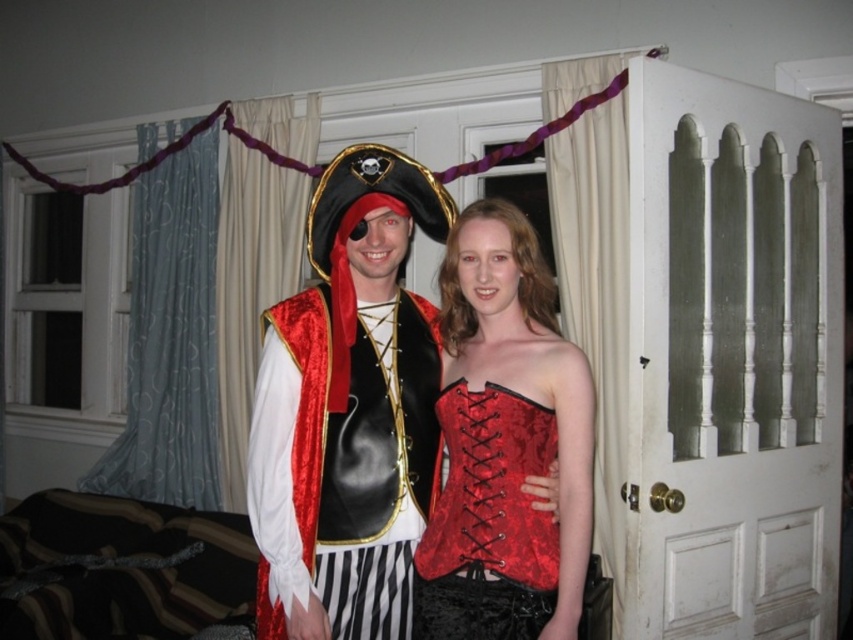
Which is below, velvet red corset at center or velvet/red vest at center?

velvet/red vest at center is below.

Find the location of a particular element. The width and height of the screenshot is (853, 640). velvet red corset at center is located at coordinates (505, 444).

The width and height of the screenshot is (853, 640). What are the coordinates of `velvet red corset at center` in the screenshot? It's located at (505, 444).

Who is taller, velvet pirate costume at center or red velvet corset at center?

Standing taller between the two is velvet pirate costume at center.

Does velvet pirate costume at center come behind red velvet corset at center?

Yes.

At what (x,y) coordinates should I click in order to perform the action: click on velvet pirate costume at center. Please return your answer as a coordinate pair (x, y). Image resolution: width=853 pixels, height=640 pixels. Looking at the image, I should click on (349, 410).

Identify the location of velvet pirate costume at center. This screenshot has width=853, height=640. (349, 410).

Can you confirm if velvet red corset at center is smaller than red velvet corset at center?

No.

In the scene shown: Between velvet red corset at center and red velvet corset at center, which one has less height?

red velvet corset at center is shorter.

This screenshot has width=853, height=640. In order to click on velvet red corset at center in this screenshot , I will do `click(505, 444)`.

Locate an element on the screen. velvet red corset at center is located at coordinates point(505,444).